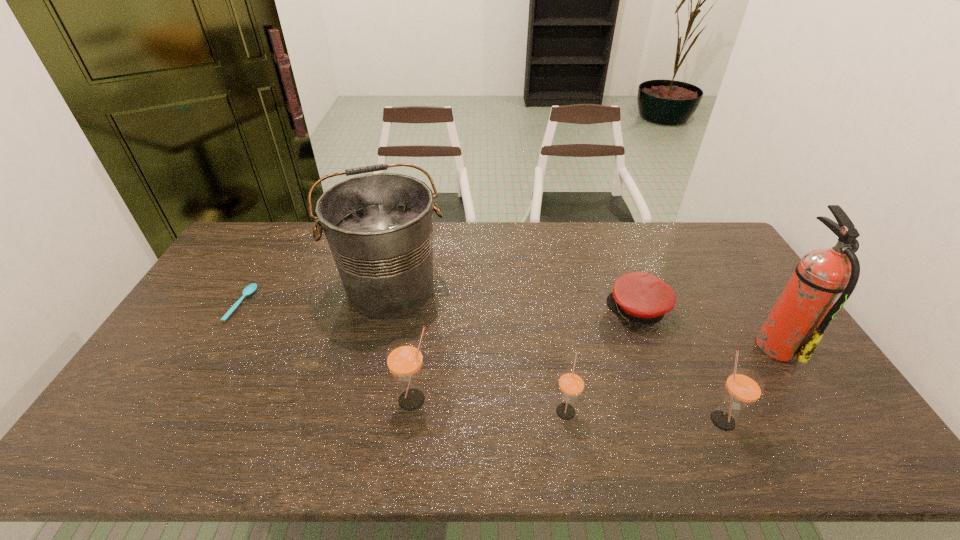
This screenshot has width=960, height=540. I want to click on free space between the second tallest straw and the bucket, so click(556, 354).

This screenshot has height=540, width=960. Identify the location of free area in between the rightmost straw and the shortest object. (482, 362).

The image size is (960, 540). I want to click on free space between the bucket and the rightmost object, so click(x=583, y=316).

The image size is (960, 540). I want to click on unoccupied area between the fourth shortest object and the bucket, so click(556, 354).

Find the location of a particular element. The image size is (960, 540). empty space between the rightmost straw and the shortest object is located at coordinates (482, 362).

Find the location of `object that stands as the sixth closest to the fourth object from left to right`. object that stands as the sixth closest to the fourth object from left to right is located at coordinates (250, 289).

The width and height of the screenshot is (960, 540). Find the location of `object that can be found as the closest to the sixth tallest object`. object that can be found as the closest to the sixth tallest object is located at coordinates (825, 278).

Identify the location of straw that is the second closest to the fire extinguisher. This screenshot has height=540, width=960. (571, 384).

Where is `straw that is the third closest to the cap`? straw that is the third closest to the cap is located at coordinates (404, 358).

Where is `blank area in the image that satisfies the following two spatial constraints: 1. at the front of the second tallest straw where the visor is located; 2. on the left side of the sixth tallest object`? The height and width of the screenshot is (540, 960). blank area in the image that satisfies the following two spatial constraints: 1. at the front of the second tallest straw where the visor is located; 2. on the left side of the sixth tallest object is located at coordinates (680, 420).